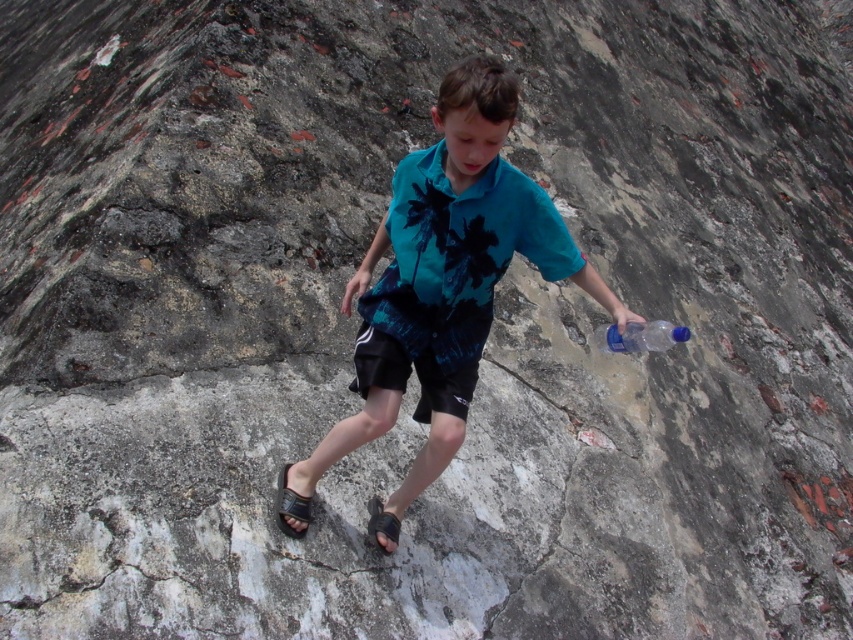
Is translucent plastic bottle at right above black rubber sandal at lower center?

Yes.

Measure the distance from translucent plastic bottle at right to black rubber sandal at lower center.

The distance of translucent plastic bottle at right from black rubber sandal at lower center is 1.21 meters.

Is point (635, 337) closer to camera compared to point (383, 545)?

Yes.

Identify the location of translucent plastic bottle at right. This screenshot has width=853, height=640. (645, 337).

Between teal fabric shirt at center and translucent plastic bottle at right, which one is positioned lower?

translucent plastic bottle at right is below.

Locate an element on the screen. The width and height of the screenshot is (853, 640). teal fabric shirt at center is located at coordinates (445, 276).

Between black matte shorts at center and translucent plastic bottle at right, which one is positioned lower?

Positioned lower is black matte shorts at center.

Does black matte shorts at center have a greater width compared to translucent plastic bottle at right?

Indeed, black matte shorts at center has a greater width compared to translucent plastic bottle at right.

Is point (456, 392) in front of point (630, 333)?

No, (456, 392) is further to viewer.

Find the location of a particular element. The height and width of the screenshot is (640, 853). black matte shorts at center is located at coordinates (419, 346).